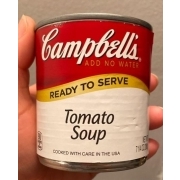
The width and height of the screenshot is (180, 180). What are the coordinates of `grey wall` in the screenshot? It's located at [x=146, y=14].